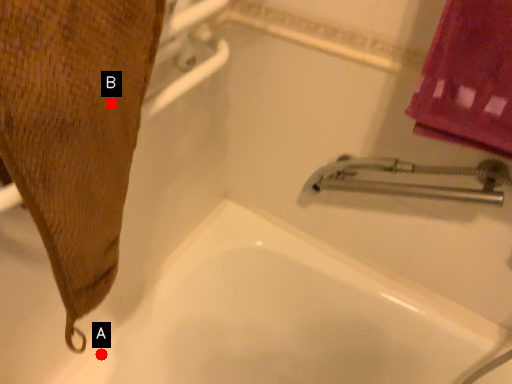
Question: Two points are circled on the image, labeled by A and B beside each circle. Which point is further to the camera?

Choices:
 (A) A is further
 (B) B is further

Answer: (A)